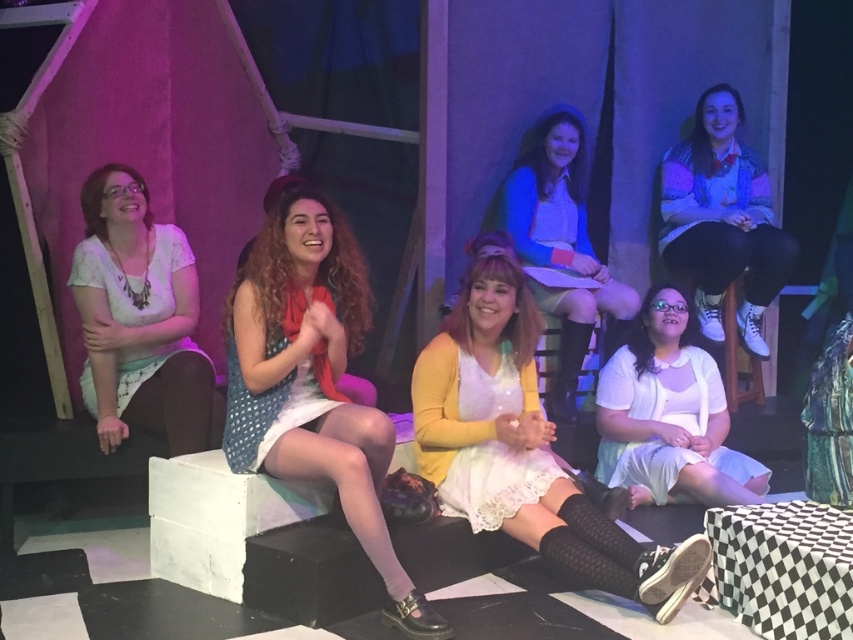
You are a costume designer observing the stage setup. You notice two people wearing the matte blue sweater at upper right and the matte blue sweater at center. Which one has a longer sweater?

The matte blue sweater at center is longer than the matte blue sweater at upper right.

Looking at this image, you are an event planner arranging a photoshoot in this scene. You need to position a tall camera stand that requires 1.2 meters of vertical space. Based on the height of the polka dot fabric dress at center and the white satin dress at lower center, is there enough vertical space for the camera stand between them?

The polka dot fabric dress at center is taller than the white satin dress at lower center. Since the camera stand needs 1.2 meters of vertical space, and the height difference between the two dresses isn